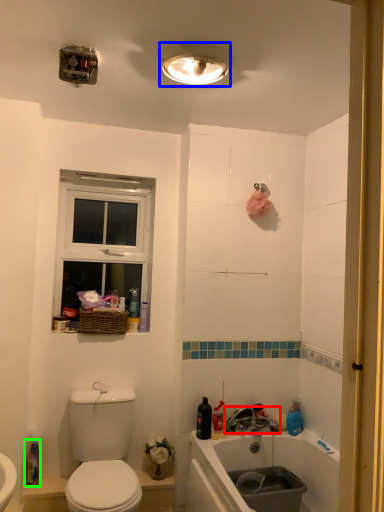
Question: Which object is the closest to the tap (highlighted by a red box)? Choose among these: light fixture (highlighted by a blue box) or cleaning product (highlighted by a green box).

Choices:
 (A) light fixture
 (B) cleaning product

Answer: (B)